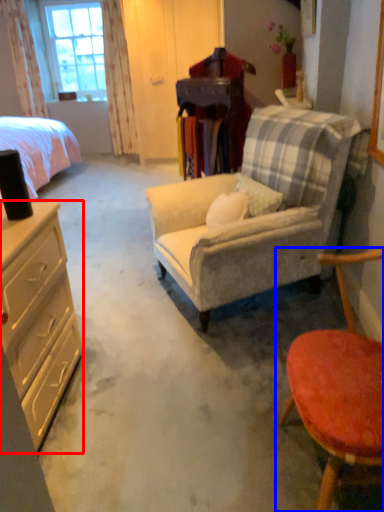
Question: Which object appears farthest to the camera in this image, desk (highlighted by a red box) or chair (highlighted by a blue box)?

Choices:
 (A) desk
 (B) chair

Answer: (A)